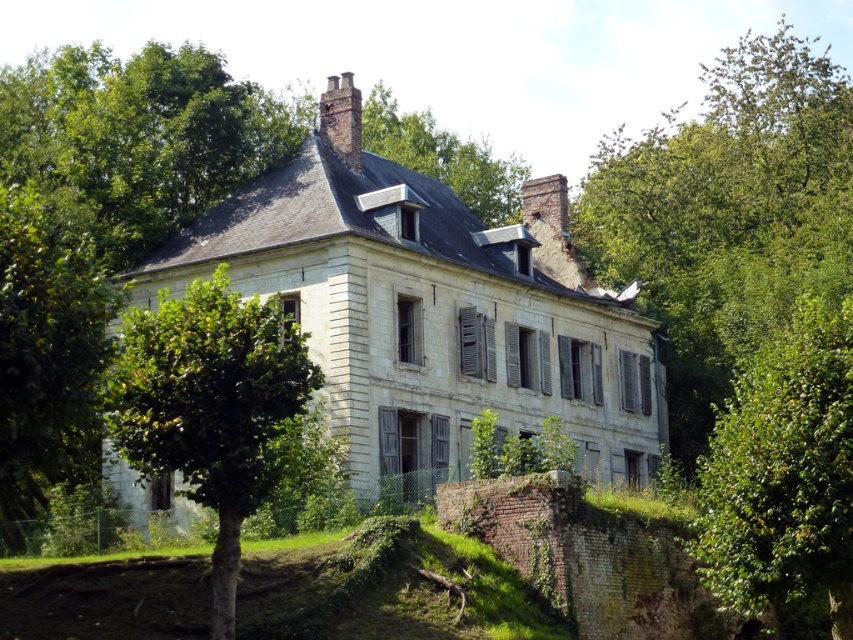
You are a drone operator planning to fly a drone over the white stone mansion at center and the brick chimney at upper center. Based on their sizes, which object would require more caution to avoid collision? Please explain.

The white stone mansion at center might be wider than the brick chimney at upper center, so it would require more caution to avoid collision due to its larger size.